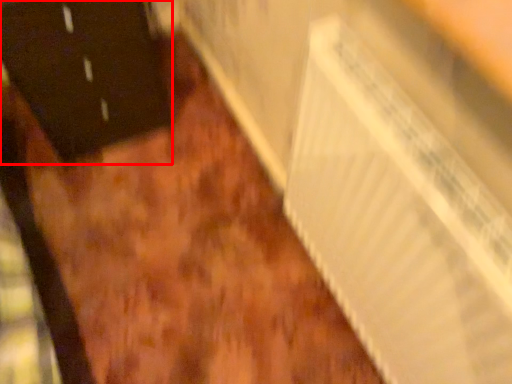
Question: Considering the relative positions of door (annotated by the red box) and radiator in the image provided, where is door (annotated by the red box) located with respect to the staircase?

Choices:
 (A) left
 (B) right

Answer: (A)